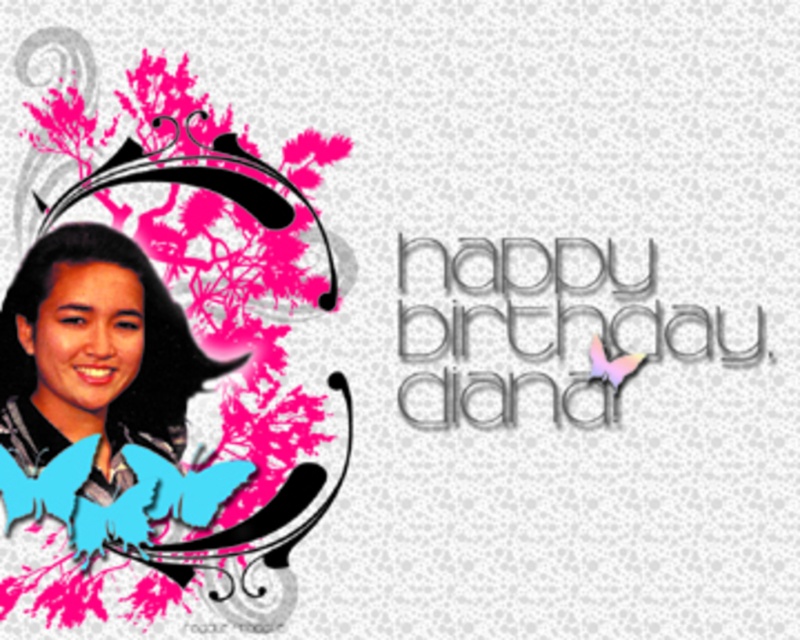
Question: Is matte black portrait at left to the right of metallic silver text at center from the viewer's perspective?

Choices:
 (A) yes
 (B) no

Answer: (B)

Question: Is matte black portrait at left to the right of matte black hair at left from the viewer's perspective?

Choices:
 (A) yes
 (B) no

Answer: (A)

Question: Which of the following is the farthest from the observer?

Choices:
 (A) (610, 371)
 (B) (158, 84)
 (C) (40, 320)

Answer: (C)

Question: Which point is closer to the camera?

Choices:
 (A) click(x=625, y=340)
 (B) click(x=32, y=432)
 (C) click(x=282, y=538)

Answer: (A)

Question: Does metallic silver text at center appear over matte black hair at left?

Choices:
 (A) no
 (B) yes

Answer: (B)

Question: Which object is positioned farthest from the matte black portrait at left?

Choices:
 (A) matte black hair at left
 (B) metallic silver text at center

Answer: (B)